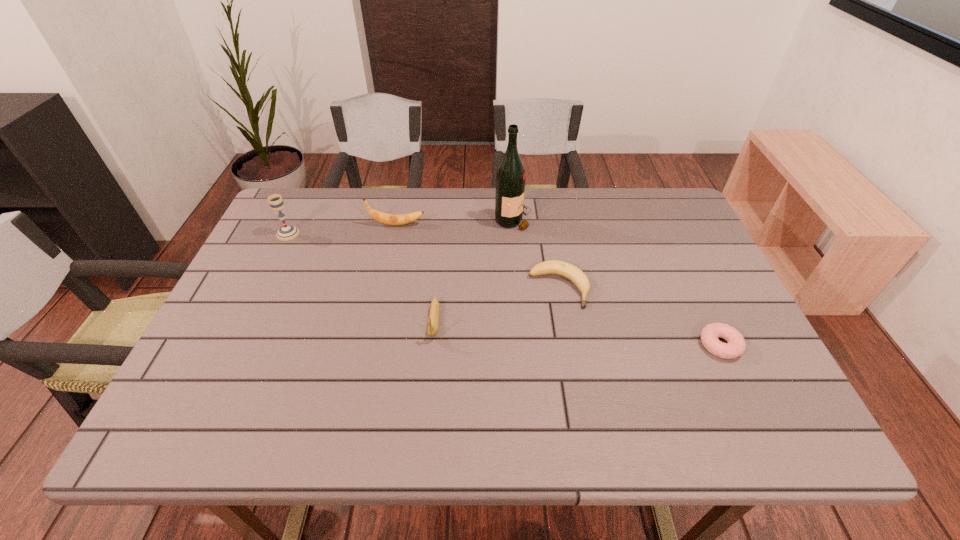
Where is `blank area located on the front of the wine bottle`? The width and height of the screenshot is (960, 540). blank area located on the front of the wine bottle is located at coordinates (524, 342).

This screenshot has height=540, width=960. Identify the location of vacant space situated 0.200m on the front of the second tallest object. (260, 291).

Where is `vacant space located 0.300m on the peel of the fourth shortest object from the top`? vacant space located 0.300m on the peel of the fourth shortest object from the top is located at coordinates (525, 224).

Where is `blank space located 0.050m at the stem of the second tallest banana`? blank space located 0.050m at the stem of the second tallest banana is located at coordinates (431, 361).

The image size is (960, 540). In order to click on free location located on the back of the shortest banana in this screenshot , I will do `click(545, 208)`.

Where is `vacant point located 0.160m on the left of the shortest object`? This screenshot has height=540, width=960. vacant point located 0.160m on the left of the shortest object is located at coordinates (629, 345).

In order to click on wine bottle present at the far edge in this screenshot , I will do point(510,177).

Image resolution: width=960 pixels, height=540 pixels. Identify the location of chalice that is at the far edge. (287, 232).

This screenshot has height=540, width=960. Find the location of `banana that is positioned at the far edge`. banana that is positioned at the far edge is located at coordinates (389, 219).

Locate an element on the screen. object that is positioned at the left edge is located at coordinates (287, 232).